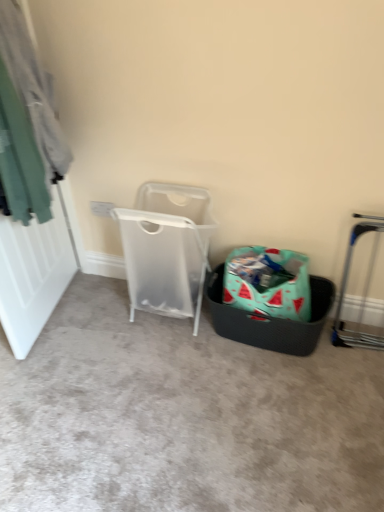
Question: Is teal woven basket at lower right shorter than silver metallic trolley at right?

Choices:
 (A) no
 (B) yes

Answer: (B)

Question: Is teal woven basket at lower right aimed at silver metallic trolley at right?

Choices:
 (A) no
 (B) yes

Answer: (A)

Question: Is teal woven basket at lower right to the left of silver metallic trolley at right from the viewer's perspective?

Choices:
 (A) no
 (B) yes

Answer: (B)

Question: Is teal woven basket at lower right further to camera compared to silver metallic trolley at right?

Choices:
 (A) no
 (B) yes

Answer: (B)

Question: Is the position of teal woven basket at lower right less distant than that of silver metallic trolley at right?

Choices:
 (A) yes
 (B) no

Answer: (B)

Question: Is teal woven basket at lower right with silver metallic trolley at right?

Choices:
 (A) yes
 (B) no

Answer: (B)

Question: Is watermelon-patterned fabric shopping bag at center behind black textured basket at center?

Choices:
 (A) no
 (B) yes

Answer: (B)

Question: Is the position of watermelon-patterned fabric shopping bag at center less distant than that of black textured basket at center?

Choices:
 (A) yes
 (B) no

Answer: (B)

Question: Considering the relative sizes of watermelon-patterned fabric shopping bag at center and black textured basket at center in the image provided, is watermelon-patterned fabric shopping bag at center bigger than black textured basket at center?

Choices:
 (A) no
 (B) yes

Answer: (A)

Question: From a real-world perspective, is watermelon-patterned fabric shopping bag at center physically above black textured basket at center?

Choices:
 (A) yes
 (B) no

Answer: (A)

Question: Is watermelon-patterned fabric shopping bag at center smaller than black textured basket at center?

Choices:
 (A) yes
 (B) no

Answer: (A)

Question: From the image's perspective, would you say watermelon-patterned fabric shopping bag at center is shown under black textured basket at center?

Choices:
 (A) yes
 (B) no

Answer: (B)

Question: Is transparent plastic laundry basket at center wider than teal fabric at left?

Choices:
 (A) yes
 (B) no

Answer: (A)